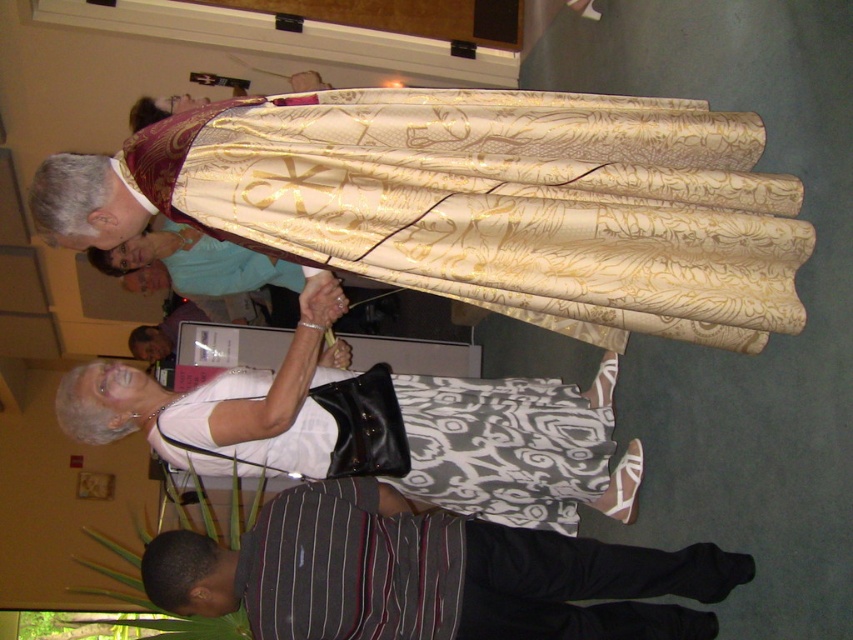
You are a photographer standing at the back of the room. You want to take a photo of the striped cotton shirt at lower center and the striped cotton shirt at center. Can you fit both shirts into your camera frame if your camera has a minimum required distance of 50 centimeters between subjects to capture them clearly?

The distance between the striped cotton shirt at lower center and striped cotton shirt at center is 53.28 centimeters, which exceeds the camera requirement of 50 centimeters. Therefore, both shirts can be captured clearly in the photo.